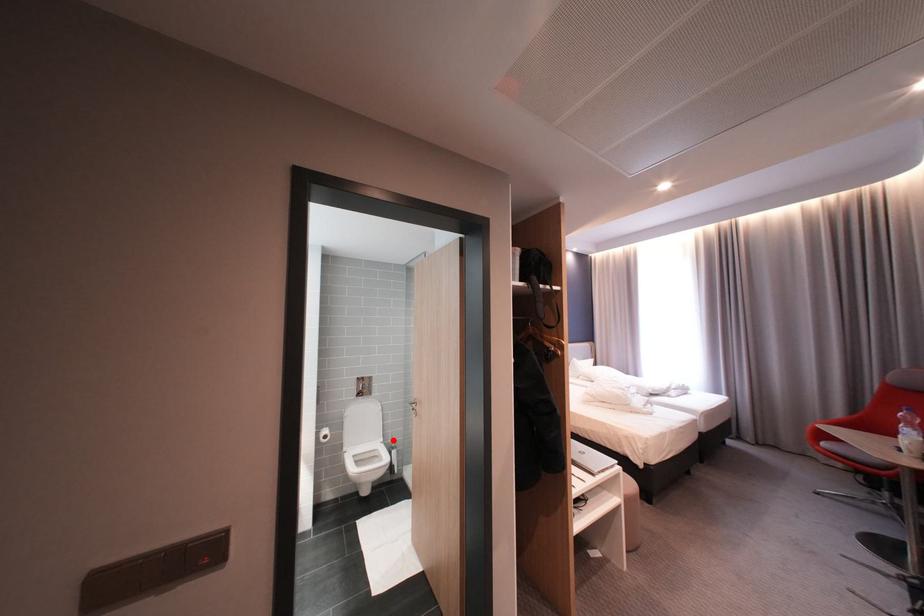
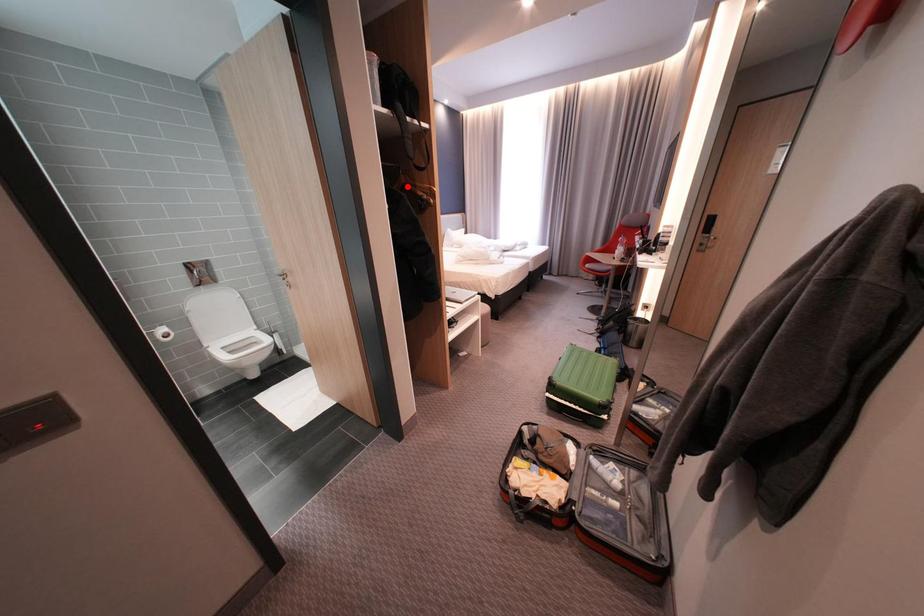
I am providing you with two images of the same scene from different viewpoints. A red point is marked on the first image and another point is marked on the second image. Do the highlighted points in image1 and image2 indicate the same real-world spot?

No